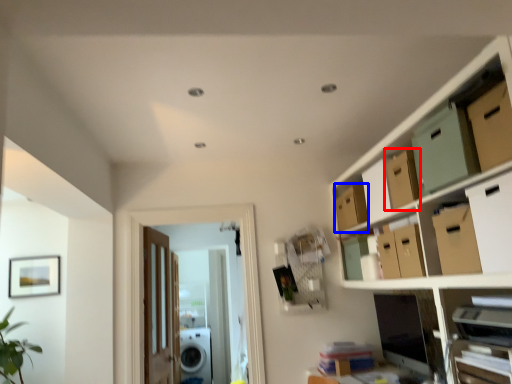
Question: Among these objects, which one is farthest to the camera, cardboard box (highlighted by a red box) or storage box (highlighted by a blue box)?

Choices:
 (A) cardboard box
 (B) storage box

Answer: (B)